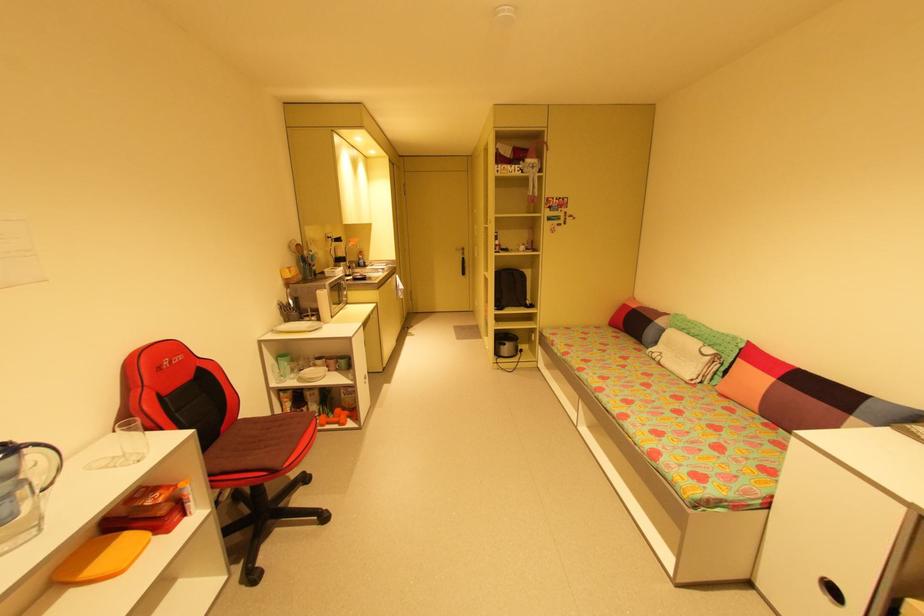
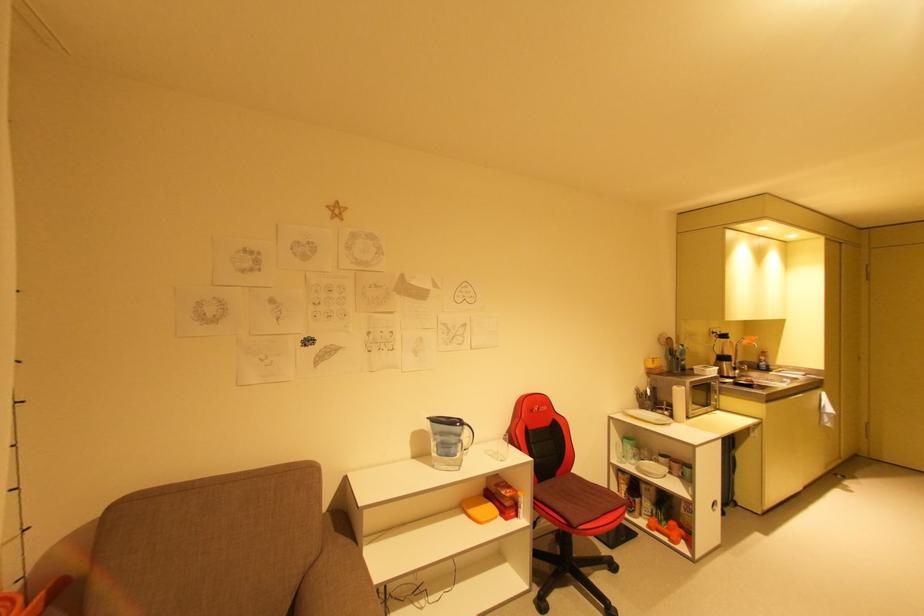
The point at (342,302) is marked in the first image. Where is the corresponding point in the second image?

(708, 403)